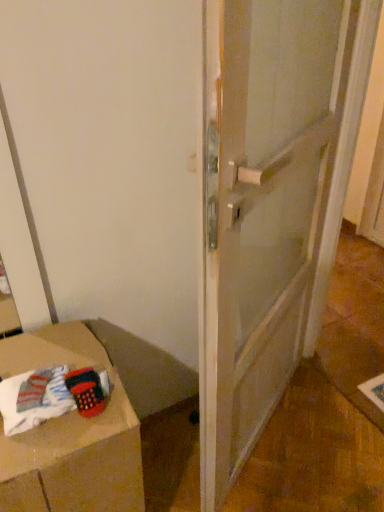
Question: From a real-world perspective, is white soft fabric at lower left under knitted fabric basket at lower left?

Choices:
 (A) no
 (B) yes

Answer: (A)

Question: Does white soft fabric at lower left appear on the right side of knitted fabric basket at lower left?

Choices:
 (A) no
 (B) yes

Answer: (B)

Question: From the image's perspective, is white soft fabric at lower left on knitted fabric basket at lower left?

Choices:
 (A) yes
 (B) no

Answer: (A)

Question: From the image's perspective, is white soft fabric at lower left beneath knitted fabric basket at lower left?

Choices:
 (A) yes
 (B) no

Answer: (B)

Question: Is white soft fabric at lower left outside of knitted fabric basket at lower left?

Choices:
 (A) no
 (B) yes

Answer: (A)

Question: Is white soft fabric at lower left surrounding knitted fabric basket at lower left?

Choices:
 (A) yes
 (B) no

Answer: (B)

Question: Is knitted fabric basket at lower left to the right of white soft fabric at lower left from the viewer's perspective?

Choices:
 (A) yes
 (B) no

Answer: (B)

Question: Would you say knitted fabric basket at lower left is a long distance from white soft fabric at lower left?

Choices:
 (A) yes
 (B) no

Answer: (B)

Question: Can you confirm if knitted fabric basket at lower left is smaller than white soft fabric at lower left?

Choices:
 (A) no
 (B) yes

Answer: (A)

Question: From the image's perspective, is knitted fabric basket at lower left located beneath white soft fabric at lower left?

Choices:
 (A) no
 (B) yes

Answer: (B)

Question: Is knitted fabric basket at lower left facing towards white soft fabric at lower left?

Choices:
 (A) no
 (B) yes

Answer: (A)

Question: Is knitted fabric basket at lower left thinner than white soft fabric at lower left?

Choices:
 (A) yes
 (B) no

Answer: (B)

Question: From the image's perspective, would you say transparent glass door at center is positioned over knitted fabric basket at lower left?

Choices:
 (A) yes
 (B) no

Answer: (A)